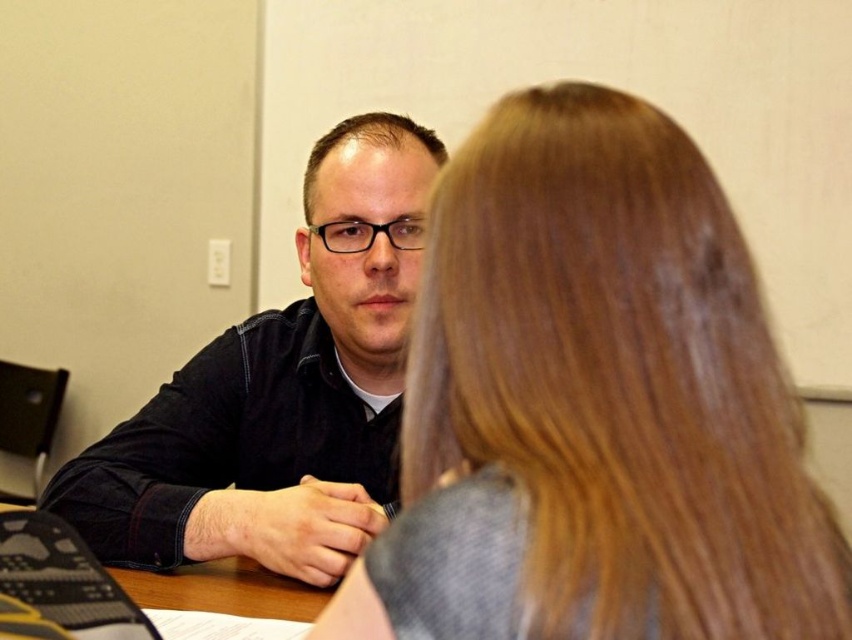
Question: Is smooth brown hair at center closer to camera compared to brown wood table at center?

Choices:
 (A) no
 (B) yes

Answer: (B)

Question: Can you confirm if smooth brown hair at center is smaller than brown wood table at center?

Choices:
 (A) no
 (B) yes

Answer: (A)

Question: Which of these objects is positioned closest to the smooth brown hair at center?

Choices:
 (A) dark blue shirt at center
 (B) brown wood table at center

Answer: (B)

Question: Estimate the real-world distances between objects in this image. Which object is farther from the brown wood table at center?

Choices:
 (A) smooth brown hair at center
 (B) dark blue shirt at center

Answer: (A)

Question: Can you confirm if dark blue shirt at center is positioned above brown wood table at center?

Choices:
 (A) no
 (B) yes

Answer: (B)

Question: Among these points, which one is nearest to the camera?

Choices:
 (A) (353, 525)
 (B) (176, 580)

Answer: (A)